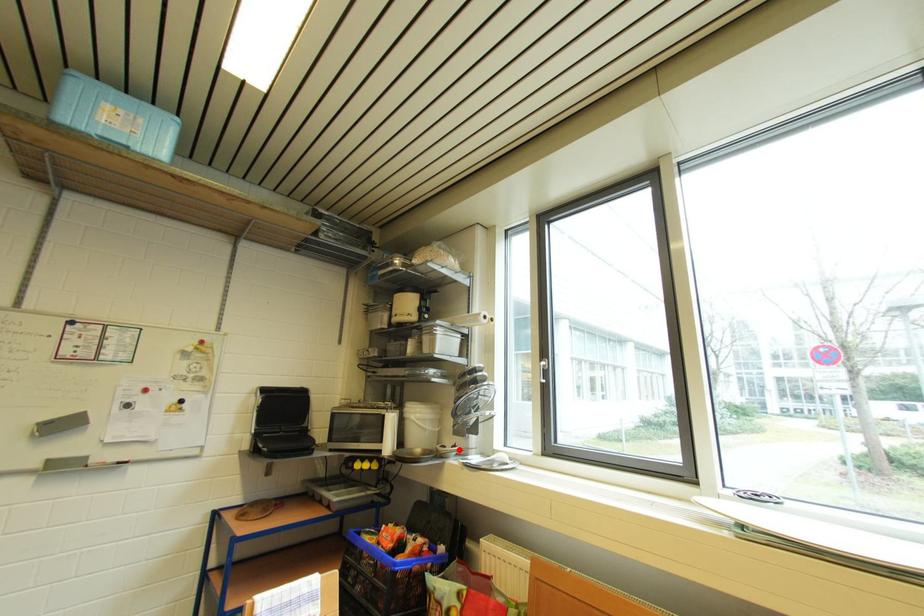
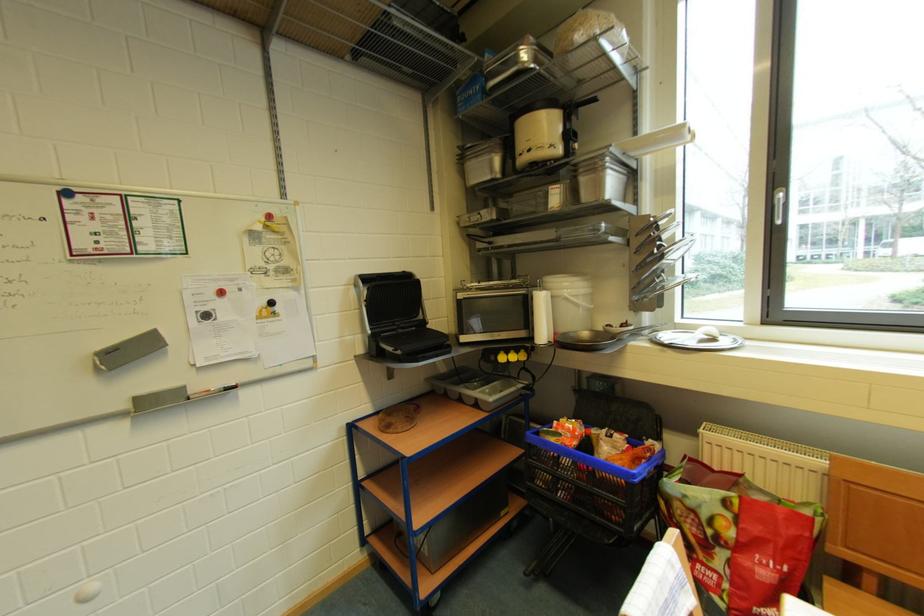
Question: I am providing you with two images of the same scene from different viewpoints. In image1, a red point is highlighted. Considering the same 3D point in image2, which of the following is correct?

Choices:
 (A) It is closer
 (B) It is farther

Answer: (A)